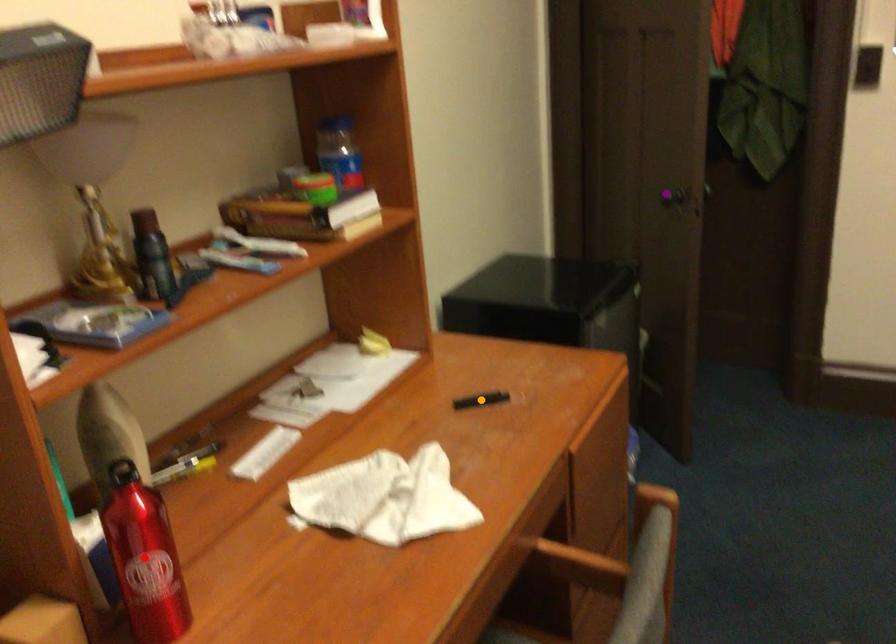
Order these from nearest to farthest:
purple point
orange point
red point

red point, orange point, purple point